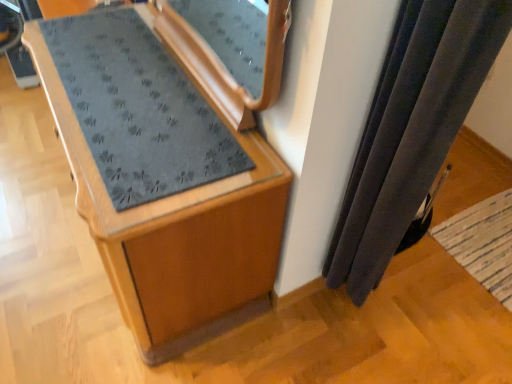
Find the location of `free space above woven beige mat at lower right (from a real-world perspective)`. free space above woven beige mat at lower right (from a real-world perspective) is located at coordinates (495, 261).